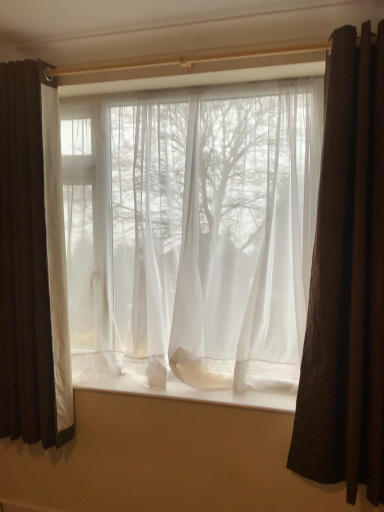
In order to face matte white curtain at left, the 3th curtain positioned from the right, should I rotate leftwards or rightwards?

A 21.753 degree turn to the left will do.

Describe the element at coordinates (195, 233) in the screenshot. I see `sheer white curtain at center, which ranks as the 2th curtain in left-to-right order` at that location.

This screenshot has width=384, height=512. Find the location of `matte white curtain at left, the 3th curtain positioned from the right`. matte white curtain at left, the 3th curtain positioned from the right is located at coordinates (32, 263).

Is matte white curtain at left, positioned as the first curtain in left-to-right order, in front of sheer white curtain at center, which ranks as the 2th curtain in left-to-right order?

No, matte white curtain at left, positioned as the first curtain in left-to-right order, is further to the viewer.

The height and width of the screenshot is (512, 384). Find the location of `curtain behind the sheer white curtain at center, placed as the second curtain when sorted from right to left`. curtain behind the sheer white curtain at center, placed as the second curtain when sorted from right to left is located at coordinates (32, 263).

From the image's perspective, is matte white curtain at left, positioned as the first curtain in left-to-right order, above or below sheer white curtain at center, which ranks as the 2th curtain in left-to-right order?

matte white curtain at left, positioned as the first curtain in left-to-right order, is situated lower than sheer white curtain at center, which ranks as the 2th curtain in left-to-right order, in the image.

Which of these two, matte white curtain at left, positioned as the first curtain in left-to-right order, or sheer white curtain at center, placed as the second curtain when sorted from right to left, is smaller?

matte white curtain at left, positioned as the first curtain in left-to-right order, is smaller.

Is white sheer fabric at center not within sheer white curtain at center, placed as the second curtain when sorted from right to left?

white sheer fabric at center is positioned outside sheer white curtain at center, placed as the second curtain when sorted from right to left.

Looking at this image, considering the relative sizes of white sheer fabric at center and sheer white curtain at center, which ranks as the 2th curtain in left-to-right order, in the image provided, is white sheer fabric at center wider than sheer white curtain at center, which ranks as the 2th curtain in left-to-right order,?

Correct, the width of white sheer fabric at center exceeds that of sheer white curtain at center, which ranks as the 2th curtain in left-to-right order.

Considering the positions of point (293, 399) and point (305, 201), is point (293, 399) closer or farther from the camera than point (305, 201)?

Point (293, 399) appears to be farther away from the viewer than point (305, 201).

From a real-world perspective, is white sheer fabric at center above or below sheer white curtain at center, which ranks as the 2th curtain in left-to-right order?

Clearly, from a real-world perspective, white sheer fabric at center is below sheer white curtain at center, which ranks as the 2th curtain in left-to-right order.

Which is in front, sheer white curtain at center, which ranks as the 2th curtain in left-to-right order, or matte white curtain at left, positioned as the first curtain in left-to-right order?

sheer white curtain at center, which ranks as the 2th curtain in left-to-right order, is closer to the camera.

Is sheer white curtain at center, which ranks as the 2th curtain in left-to-right order, positioned far away from matte white curtain at left, the 3th curtain positioned from the right?

No, sheer white curtain at center, which ranks as the 2th curtain in left-to-right order, is in close proximity to matte white curtain at left, the 3th curtain positioned from the right.

Who is taller, sheer white curtain at center, placed as the second curtain when sorted from right to left, or matte white curtain at left, positioned as the first curtain in left-to-right order?

matte white curtain at left, positioned as the first curtain in left-to-right order.

From the image's perspective, would you say sheer white curtain at center, placed as the second curtain when sorted from right to left, is positioned over matte white curtain at left, the 3th curtain positioned from the right?

Indeed, from the image's perspective, sheer white curtain at center, placed as the second curtain when sorted from right to left, is shown above matte white curtain at left, the 3th curtain positioned from the right.

Considering the positions of objects brown velvet curtain at right, positioned as the third curtain in left-to-right order, and matte white curtain at left, the 3th curtain positioned from the right, in the image provided, who is in front, brown velvet curtain at right, positioned as the third curtain in left-to-right order, or matte white curtain at left, the 3th curtain positioned from the right,?

brown velvet curtain at right, positioned as the third curtain in left-to-right order, is in front.

Between brown velvet curtain at right, positioned as the third curtain in left-to-right order, and matte white curtain at left, positioned as the first curtain in left-to-right order, which one has less height?

matte white curtain at left, positioned as the first curtain in left-to-right order, is shorter.

From a real-world perspective, who is located lower, brown velvet curtain at right, positioned as the third curtain in left-to-right order, or matte white curtain at left, the 3th curtain positioned from the right?

In real-world perspective, brown velvet curtain at right, positioned as the third curtain in left-to-right order, is lower.

Which point is more forward, (353, 280) or (35, 110)?

The point (353, 280) is in front.

Would you say brown velvet curtain at right, positioned as the third curtain in left-to-right order, is outside white sheer fabric at center?

brown velvet curtain at right, positioned as the third curtain in left-to-right order, is positioned outside white sheer fabric at center.

Which object is closer to the camera, brown velvet curtain at right, which is counted as the first curtain, starting from the right, or white sheer fabric at center?

brown velvet curtain at right, which is counted as the first curtain, starting from the right.

Looking at this image, would you consider brown velvet curtain at right, which is counted as the first curtain, starting from the right, to be distant from white sheer fabric at center?

brown velvet curtain at right, which is counted as the first curtain, starting from the right, is near white sheer fabric at center, not far away.

In the scene shown: Can you confirm if brown velvet curtain at right, positioned as the third curtain in left-to-right order, is positioned to the left of white sheer fabric at center?

No.

Is matte white curtain at left, positioned as the first curtain in left-to-right order, oriented towards brown velvet curtain at right, which is counted as the first curtain, starting from the right?

No, matte white curtain at left, positioned as the first curtain in left-to-right order, is not oriented towards brown velvet curtain at right, which is counted as the first curtain, starting from the right.

Between matte white curtain at left, positioned as the first curtain in left-to-right order, and brown velvet curtain at right, positioned as the third curtain in left-to-right order, which one has smaller size?

Smaller between the two is brown velvet curtain at right, positioned as the third curtain in left-to-right order.

How different are the orientations of matte white curtain at left, the 3th curtain positioned from the right, and brown velvet curtain at right, which is counted as the first curtain, starting from the right, in degrees?

The angle between the facing direction of matte white curtain at left, the 3th curtain positioned from the right, and the facing direction of brown velvet curtain at right, which is counted as the first curtain, starting from the right, is 0.367 degrees.

Is point (11, 319) less distant than point (366, 145)?

No, (11, 319) is behind (366, 145).

Is there a large distance between white sheer fabric at center and brown velvet curtain at right, positioned as the third curtain in left-to-right order?

No, there isn't a large distance between white sheer fabric at center and brown velvet curtain at right, positioned as the third curtain in left-to-right order.

Is white sheer fabric at center not inside brown velvet curtain at right, which is counted as the first curtain, starting from the right?

Yes, white sheer fabric at center is outside of brown velvet curtain at right, which is counted as the first curtain, starting from the right.

Where is `window sill lying on the left of brown velvet curtain at right, positioned as the third curtain in left-to-right order`? This screenshot has width=384, height=512. window sill lying on the left of brown velvet curtain at right, positioned as the third curtain in left-to-right order is located at coordinates point(169,384).

The width and height of the screenshot is (384, 512). I want to click on the 1st curtain directly beneath the sheer white curtain at center, placed as the second curtain when sorted from right to left (from a real-world perspective), so click(x=32, y=263).

At what (x,y) coordinates should I click in order to perform the action: click on curtain that is the 3rd object located above the white sheer fabric at center (from the image's perspective). Please return your answer as a coordinate pair (x, y). Looking at the image, I should click on (195, 233).

From the picture: When comparing their distances from brown velvet curtain at right, which is counted as the first curtain, starting from the right, does white sheer fabric at center or sheer white curtain at center, placed as the second curtain when sorted from right to left, seem further?

white sheer fabric at center is further to brown velvet curtain at right, which is counted as the first curtain, starting from the right.

Looking at the image, which one is located further to white sheer fabric at center, sheer white curtain at center, placed as the second curtain when sorted from right to left, or matte white curtain at left, positioned as the first curtain in left-to-right order?

Based on the image, matte white curtain at left, positioned as the first curtain in left-to-right order, appears to be further to white sheer fabric at center.

Estimate the real-world distances between objects in this image. Which object is closer to matte white curtain at left, positioned as the first curtain in left-to-right order, white sheer fabric at center or sheer white curtain at center, placed as the second curtain when sorted from right to left?

sheer white curtain at center, placed as the second curtain when sorted from right to left, lies closer to matte white curtain at left, positioned as the first curtain in left-to-right order, than the other object.

Looking at the image, which one is located closer to brown velvet curtain at right, which is counted as the first curtain, starting from the right, matte white curtain at left, the 3th curtain positioned from the right, or sheer white curtain at center, which ranks as the 2th curtain in left-to-right order?

The object closer to brown velvet curtain at right, which is counted as the first curtain, starting from the right, is sheer white curtain at center, which ranks as the 2th curtain in left-to-right order.

Based on their spatial positions, is brown velvet curtain at right, which is counted as the first curtain, starting from the right, or sheer white curtain at center, which ranks as the 2th curtain in left-to-right order, closer to white sheer fabric at center?

The object closer to white sheer fabric at center is sheer white curtain at center, which ranks as the 2th curtain in left-to-right order.

Considering their positions, is matte white curtain at left, the 3th curtain positioned from the right, positioned closer to white sheer fabric at center than sheer white curtain at center, placed as the second curtain when sorted from right to left?

Based on the image, sheer white curtain at center, placed as the second curtain when sorted from right to left, appears to be nearer to white sheer fabric at center.

From the image, which object appears to be nearer to matte white curtain at left, positioned as the first curtain in left-to-right order, white sheer fabric at center or brown velvet curtain at right, positioned as the third curtain in left-to-right order?

The object closer to matte white curtain at left, positioned as the first curtain in left-to-right order, is white sheer fabric at center.

When comparing their distances from sheer white curtain at center, placed as the second curtain when sorted from right to left, does white sheer fabric at center or matte white curtain at left, the 3th curtain positioned from the right, seem closer?

The object closer to sheer white curtain at center, placed as the second curtain when sorted from right to left, is matte white curtain at left, the 3th curtain positioned from the right.

Find the location of a particular element. Image resolution: width=384 pixels, height=512 pixels. window sill between matte white curtain at left, positioned as the first curtain in left-to-right order, and brown velvet curtain at right, positioned as the third curtain in left-to-right order, in the horizontal direction is located at coordinates (169, 384).

The width and height of the screenshot is (384, 512). I want to click on curtain between matte white curtain at left, positioned as the first curtain in left-to-right order, and brown velvet curtain at right, which is counted as the first curtain, starting from the right, so point(195,233).

The width and height of the screenshot is (384, 512). Find the location of `window sill between matte white curtain at left, positioned as the first curtain in left-to-right order, and sheer white curtain at center, which ranks as the 2th curtain in left-to-right order, in the horizontal direction`. window sill between matte white curtain at left, positioned as the first curtain in left-to-right order, and sheer white curtain at center, which ranks as the 2th curtain in left-to-right order, in the horizontal direction is located at coordinates (169, 384).